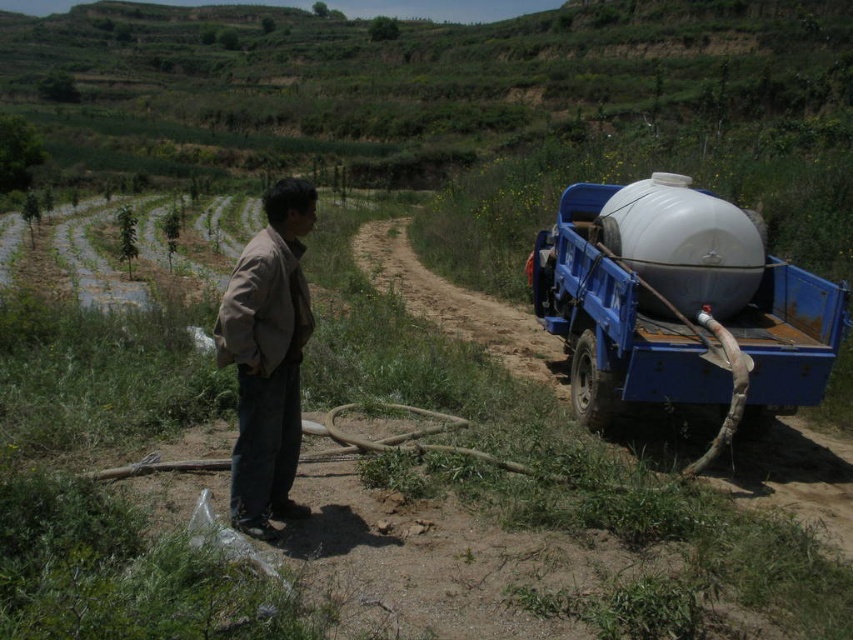
You are a farmer who needs to connect a new hose to the tank that is further to the right. Which tank should you approach, the white glossy tank at right or the white matte water tank at right?

You should approach the white matte water tank at right because the white glossy tank at right is to the left of it, making the white matte water tank at right the one further to the right.

You are a farmer who needs to check the water level in the white matte water tank at right. You have a measuring stick that is 1.2 meters long. The brown cotton jacket at center is currently blocking your path to the tank. Can you use the measuring stick to reach over the jacket and check the tank without moving the jacket?

The brown cotton jacket at center is smaller than the white matte water tank at right, but the question of whether the measuring stick can reach over the jacket depends on the distance between the jacket and the tank. Since the jacket is blocking the path, but its size is smaller than the tank, it might be possible to maneuver around or over it with the stick. However, without knowing the exact distance or the jacket material, it is uncertain. The answer cannot be definitively determined with the given info